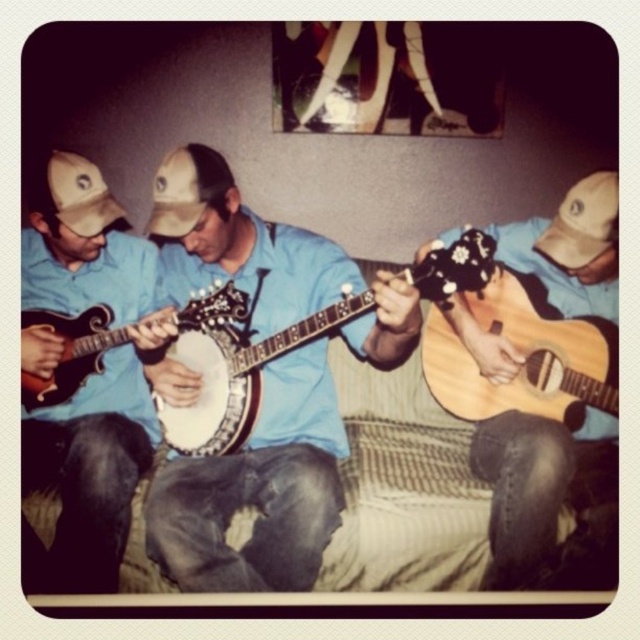
Question: Which point appears closest to the camera in this image?

Choices:
 (A) (100, 333)
 (B) (576, 266)
 (C) (22, 456)

Answer: (B)

Question: Does natural wood acoustic guitar at center have a smaller size compared to brown fabric baseball cap at left?

Choices:
 (A) yes
 (B) no

Answer: (B)

Question: Estimate the real-world distances between objects in this image. Which object is farther from the white wood banjo at center?

Choices:
 (A) wooden acoustic guitar at center
 (B) tan fabric baseball cap at upper right
 (C) natural wood acoustic guitar at center
 (D) matte white banjo at center

Answer: (B)

Question: Does white wood banjo at center have a lesser width compared to matte white banjo at center?

Choices:
 (A) yes
 (B) no

Answer: (B)

Question: Which point is farther to the camera?

Choices:
 (A) (64, 358)
 (B) (45, 186)
 (C) (541, 332)
 (D) (582, 205)

Answer: (A)

Question: Does matte blue shirt at center appear over white wood banjo at center?

Choices:
 (A) yes
 (B) no

Answer: (B)